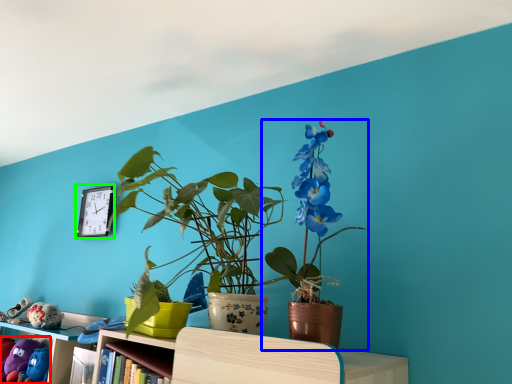
Question: Estimate the real-world distances between objects in this image. Which object is farther from toy (highlighted by a red box), houseplant (highlighted by a blue box) or clock (highlighted by a green box)?

Choices:
 (A) houseplant
 (B) clock

Answer: (A)